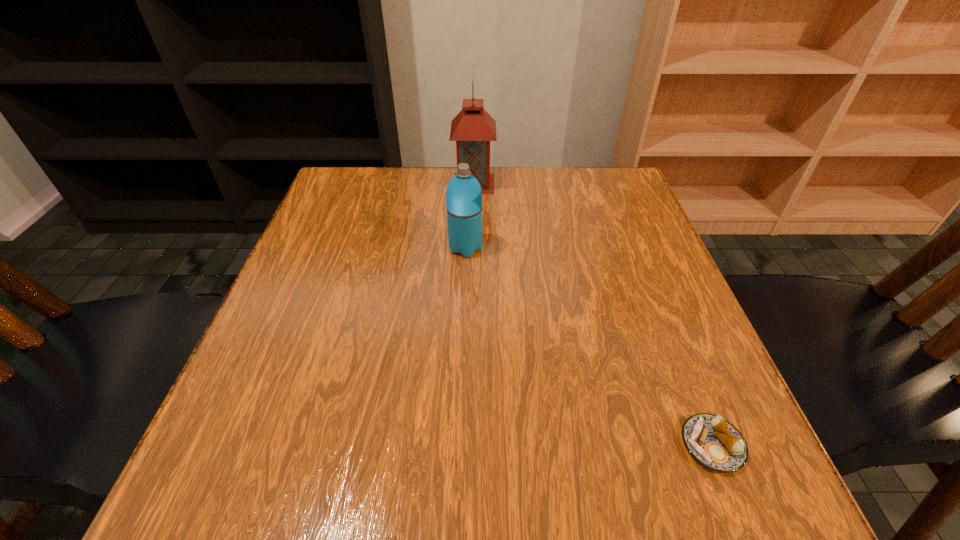
I want to click on object present at the near edge, so pos(714,442).

Find the location of a particular element. The image size is (960, 540). object that is positioned at the right edge is located at coordinates (714, 442).

Find the location of a particular element. Image resolution: width=960 pixels, height=540 pixels. object present at the near right corner is located at coordinates (714, 442).

Find the location of `free space at the far edge of the desktop`. free space at the far edge of the desktop is located at coordinates (412, 179).

You are a GUI agent. You are given a task and a screenshot of the screen. Output one action in this format:
    pyautogui.click(x=<x>, y=<y>)
    Task: Click on the free region at the near edge
    This screenshot has width=960, height=540.
    Given the screenshot: What is the action you would take?
    pyautogui.click(x=412, y=497)

Locate an element on the screen. vacant space at the left edge of the desktop is located at coordinates (279, 414).

Locate an element on the screen. The height and width of the screenshot is (540, 960). vacant space at the right edge of the desktop is located at coordinates (615, 241).

The width and height of the screenshot is (960, 540). In the image, there is a desktop. Find the location of `vacant space at the far left corner`. vacant space at the far left corner is located at coordinates (361, 172).

This screenshot has height=540, width=960. In order to click on vacant region at the near left corner of the desktop in this screenshot , I will do `click(210, 481)`.

Where is `free space at the far right corner`? free space at the far right corner is located at coordinates (625, 188).